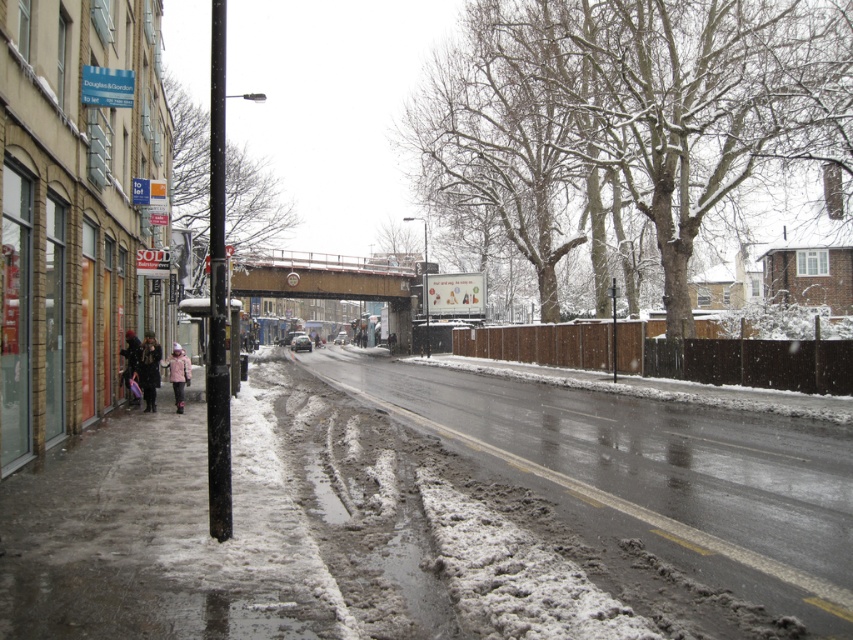
Question: Is blue plastic sign at upper left smaller than pink woolen jacket at lower left?

Choices:
 (A) yes
 (B) no

Answer: (A)

Question: Which of the following is the closest to the observer?

Choices:
 (A) blue plastic sign at upper left
 (B) dark brown coat at lower left
 (C) snowy concrete sidewalk at lower left

Answer: (C)

Question: Considering the relative positions of snowy concrete sidewalk at lower left and dark brown coat at lower left in the image provided, where is snowy concrete sidewalk at lower left located with respect to dark brown coat at lower left?

Choices:
 (A) above
 (B) below

Answer: (B)

Question: Which point is farther from the camera taking this photo?

Choices:
 (A) (344, 260)
 (B) (212, 444)
 (C) (181, 365)

Answer: (A)

Question: Which of these objects is positioned farthest from the pink woolen jacket at lower left?

Choices:
 (A) black metal pole at left
 (B) dark brown coat at lower left
 (C) blue plastic sign at upper left
 (D) brown wooden bridge at center

Answer: (D)

Question: Is snowy concrete sidewalk at lower left to the left of matte black jacket at lower left from the viewer's perspective?

Choices:
 (A) no
 (B) yes

Answer: (A)